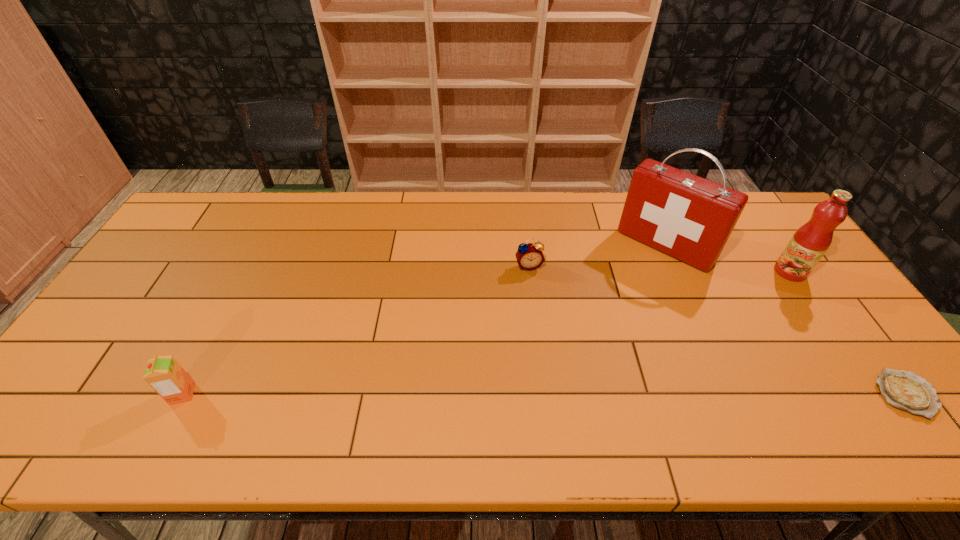
Locate an element on the screen. empty location between the orange juice and the tallest object is located at coordinates (423, 320).

Find the location of a particular element. The image size is (960, 540). empty space between the orange juice and the fruit juice is located at coordinates (487, 333).

Locate an element on the screen. The image size is (960, 540). free space between the second shortest object and the tallest object is located at coordinates (597, 256).

Identify the location of vacant area that lies between the fruit juice and the tallest object. (728, 259).

You are a GUI agent. You are given a task and a screenshot of the screen. Output one action in this format:
    pyautogui.click(x=<x>, y=<y>)
    Task: Click on the vacant area that lies between the third tallest object and the shortest object
    The image size is (960, 540).
    Given the screenshot: What is the action you would take?
    pyautogui.click(x=544, y=394)

Identify the location of free area in between the second shortest object and the third object from right to left. This screenshot has height=540, width=960. (597, 256).

Find the location of a particular element. free space that is in between the fourth object from right to left and the quiche is located at coordinates (718, 330).

I want to click on empty space that is in between the quiche and the alarm clock, so click(718, 330).

At what (x,y) coordinates should I click in order to perform the action: click on free space between the alarm clock and the third object from right to left. Please return your answer as a coordinate pair (x, y). Looking at the image, I should click on (597, 256).

Where is `vacant region between the shortest object and the alarm clock`? vacant region between the shortest object and the alarm clock is located at coordinates (718, 330).